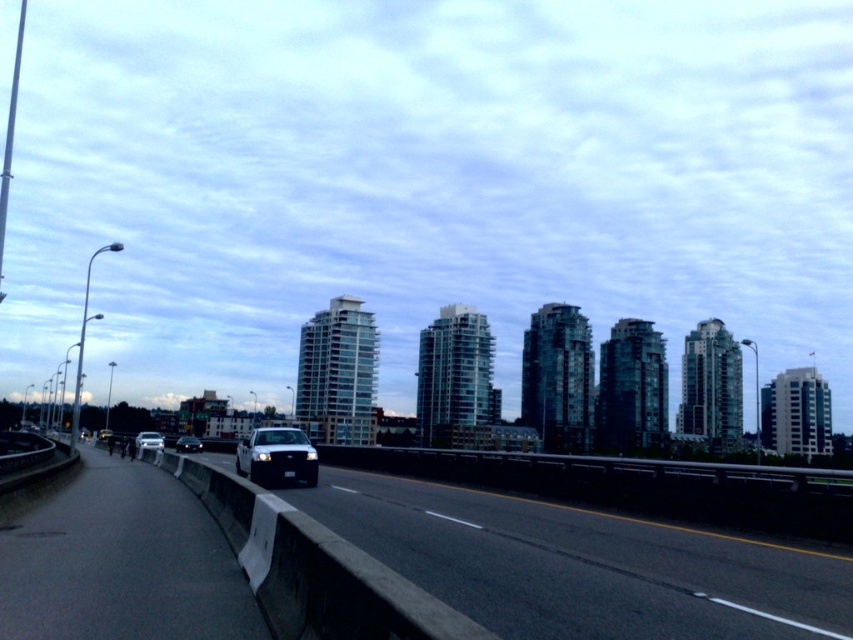
Question: Does black asphalt highway at center appear under silver metallic sedan at center?

Choices:
 (A) no
 (B) yes

Answer: (A)

Question: Which object is the farthest from the black glossy sedan at center?

Choices:
 (A) shiny white sedan at center
 (B) metallic silver sedan at center
 (C) black asphalt highway at center
 (D) silver metallic sedan at center

Answer: (C)

Question: Does silver metallic sedan at center have a smaller size compared to black glossy sedan at center?

Choices:
 (A) yes
 (B) no

Answer: (B)

Question: Which point appears farthest from the camera in this image?

Choices:
 (A) (178, 440)
 (B) (106, 436)

Answer: (B)

Question: Can you confirm if black glossy sedan at center is positioned above metallic silver sedan at center?

Choices:
 (A) yes
 (B) no

Answer: (A)

Question: Among these objects, which one is farthest from the camera?

Choices:
 (A) black glossy sedan at center
 (B) silver metallic sedan at center
 (C) shiny white sedan at center

Answer: (A)